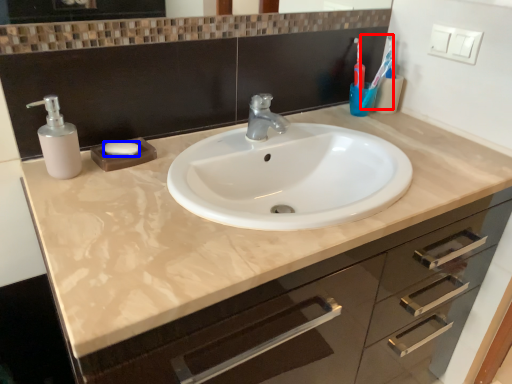
Question: Among these objects, which one is nearest to the camera, toothbrush (highlighted by a red box) or soap (highlighted by a blue box)?

Choices:
 (A) toothbrush
 (B) soap

Answer: (B)